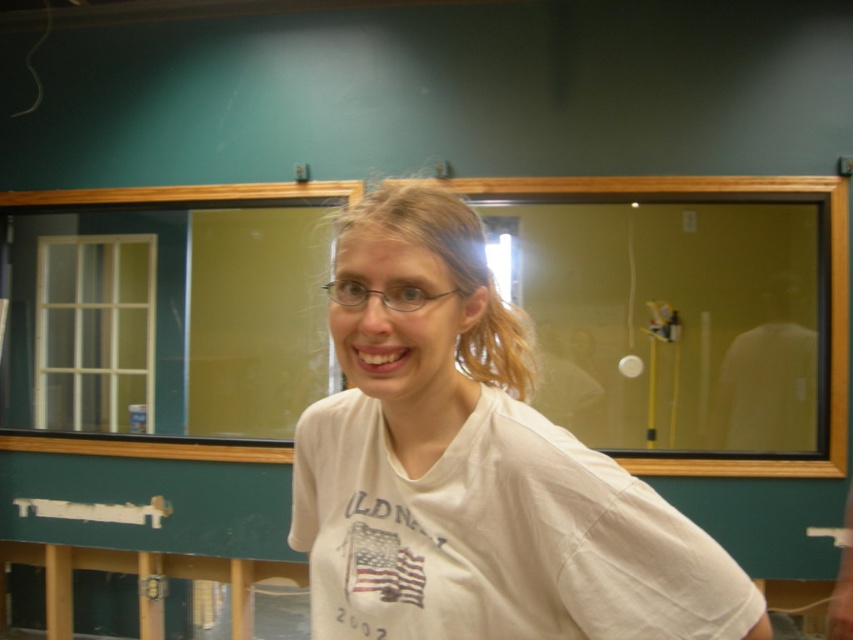
You are taking a photo of the scene and want to focus on both the point at (x=376, y=602) and the point at (x=332, y=294). Which point is closer to the camera?

Point (x=332, y=294) is closer to the camera than point (x=376, y=602).